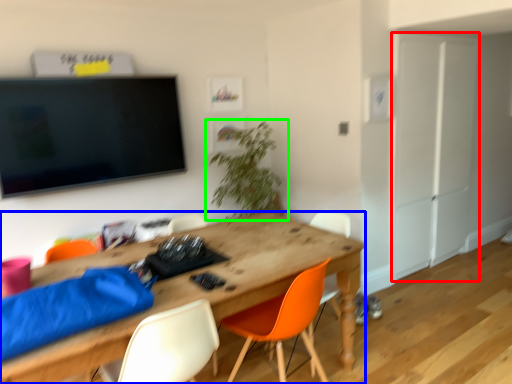
Question: Which object is the closest to the armoire (highlighted by a red box)? Choose among these: desk (highlighted by a blue box) or houseplant (highlighted by a green box).

Choices:
 (A) desk
 (B) houseplant

Answer: (B)